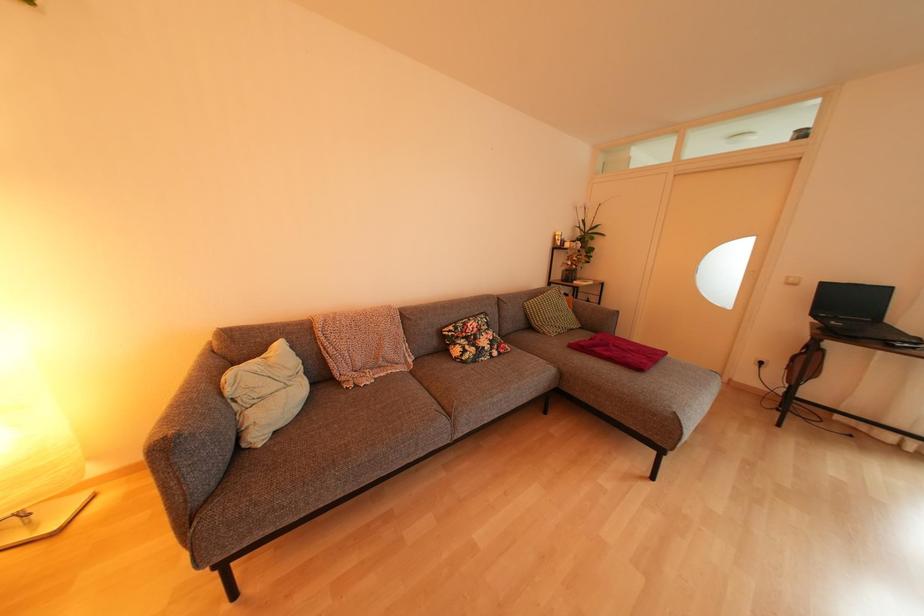
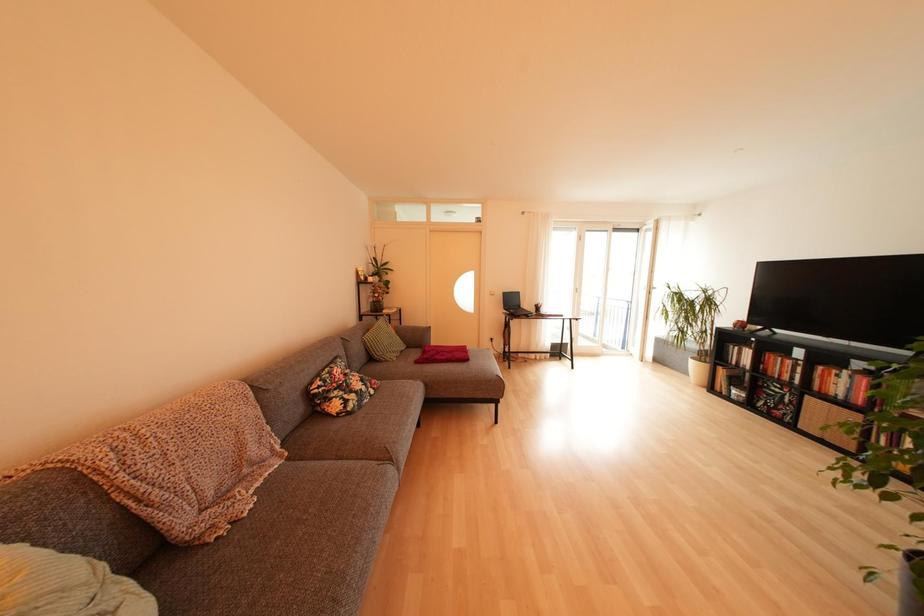
Question: The first image is from the beginning of the video and the second image is from the end. How did the camera likely rotate when shooting the video?

Choices:
 (A) Left
 (B) Right
 (C) Up
 (D) Down

Answer: (B)